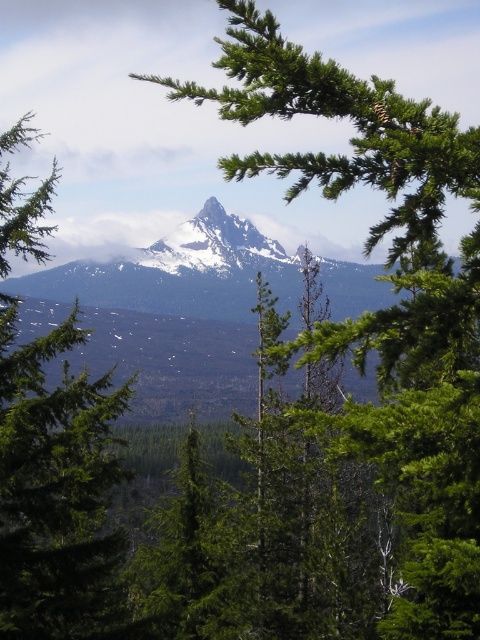
You are an artist sketching this mountain scene. You want to draw the green leafy branch at center and the green matte tree at center accurately. Which object should you draw first if you follow the standard left to right drawing technique?

The green matte tree at center should be drawn first because the green leafy branch at center is positioned on the right side of it.